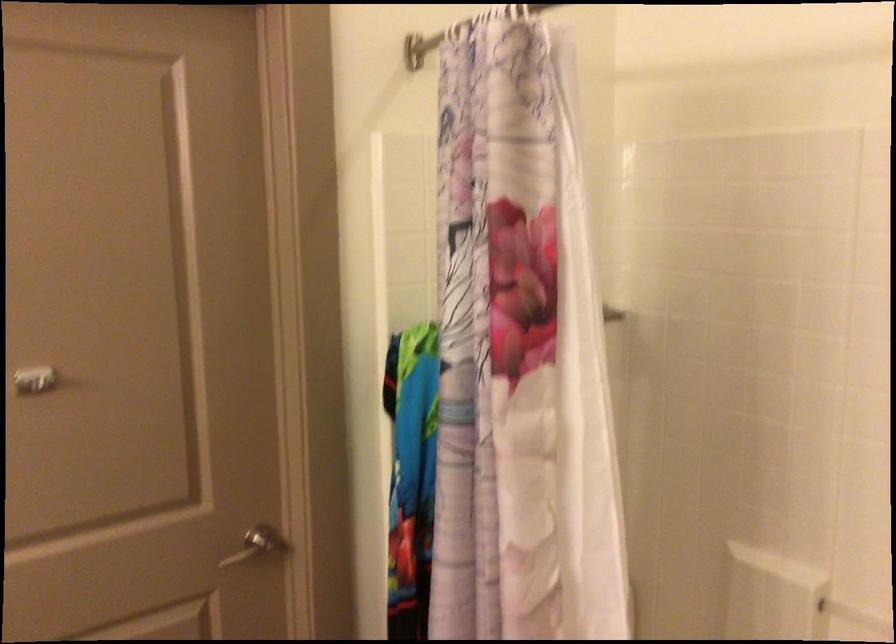
The location [519,351] corresponds to which object?

It corresponds to the patterned shower curtain in the image.